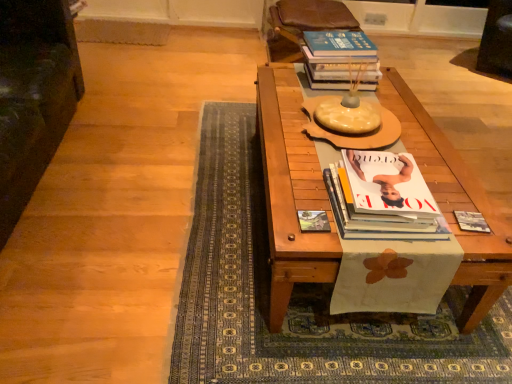
Question: In the image, is brown leather armchair at upper center, which is the first armchair in right-to-left order, positioned in front of or behind white glossy magazine at center, the first book in the front-to-back sequence?

Choices:
 (A) behind
 (B) front

Answer: (A)

Question: Would you say brown leather armchair at upper center, which is the first armchair in right-to-left order, is to the left or to the right of white glossy magazine at center, the first book in the front-to-back sequence, in the picture?

Choices:
 (A) left
 (B) right

Answer: (B)

Question: Considering the real-world distances, which object is closest to the brown leather armchair at upper center, which is the first armchair in right-to-left order?

Choices:
 (A) wooden table at center
 (B) blue hardcover book at upper right, the third book ordered from the bottom
 (C) matte black book at right, the 2th book when ordered from back to front
 (D) matte paper book cover at center
 (E) dark green fabric armchair at left, the second armchair when ordered from right to left

Answer: (B)

Question: Which object is the closest to the matte paper book cover at center?

Choices:
 (A) brown leather armchair at upper center, which is the first armchair in right-to-left order
 (B) dark green fabric armchair at left, marked as the second armchair in a back-to-front arrangement
 (C) wooden table at center
 (D) white glossy magazine at center, which is counted as the 2th book, starting from the bottom
 (E) matte black book at right, which is the 2th book in front-to-back order

Answer: (D)